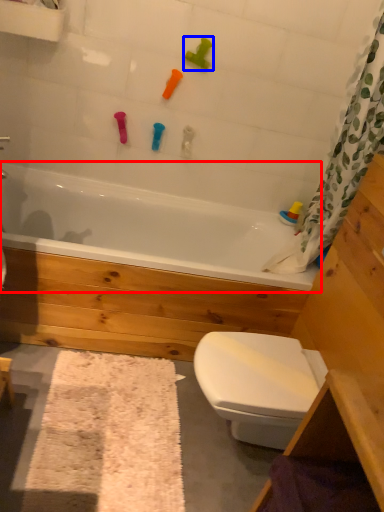
Question: Which object appears closest to the camera in this image, bathtub (highlighted by a red box) or toy (highlighted by a blue box)?

Choices:
 (A) bathtub
 (B) toy

Answer: (A)